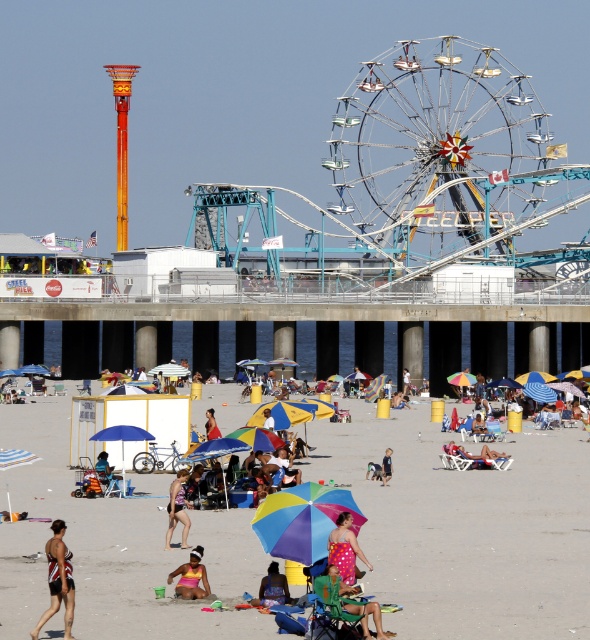
Question: Can you confirm if yellow bikini at center is thinner than matte pink bikini at center?

Choices:
 (A) no
 (B) yes

Answer: (A)

Question: Where is metallic silver ferris wheel at center located in relation to pink fabric bikini at center in the image?

Choices:
 (A) left
 (B) right

Answer: (B)

Question: Based on their relative distances, which object is nearer to the red fabric umbrella at center?

Choices:
 (A) multicolored swimsuit at center
 (B) metallic silver ferris wheel at center
 (C) multicolored umbrella at center

Answer: (A)

Question: Which of the following is the farthest from the observer?

Choices:
 (A) (198, 561)
 (B) (354, 524)
 (C) (385, 458)

Answer: (C)

Question: Does pink polka dot dress at center have a lesser width compared to multicolored umbrella at center?

Choices:
 (A) yes
 (B) no

Answer: (A)

Question: Which of these objects is positioned closest to the multicolored umbrellas at center?

Choices:
 (A) multicolored swimsuit at center
 (B) matte pink bikini at center
 (C) pink polka dot dress at center
 (D) multicolored umbrella at center

Answer: (A)